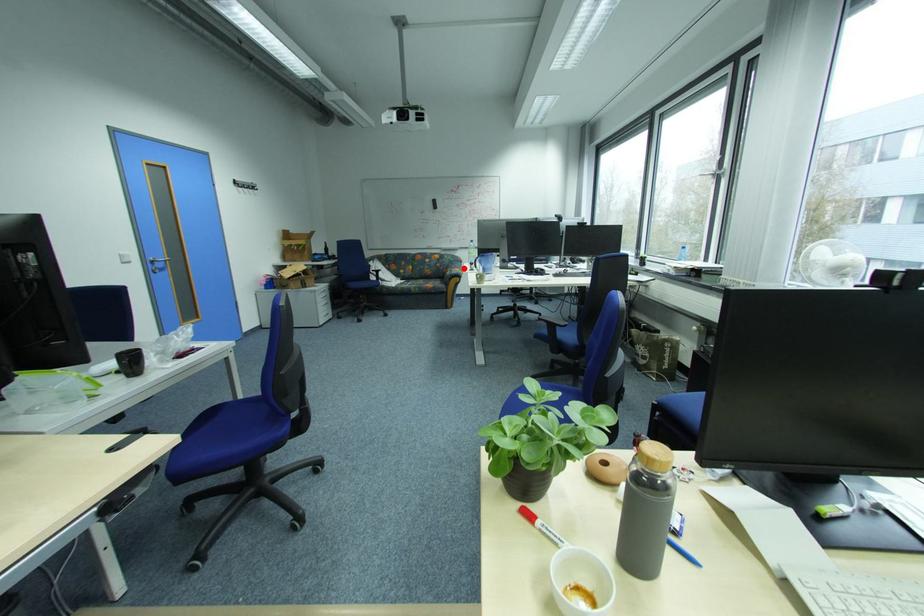
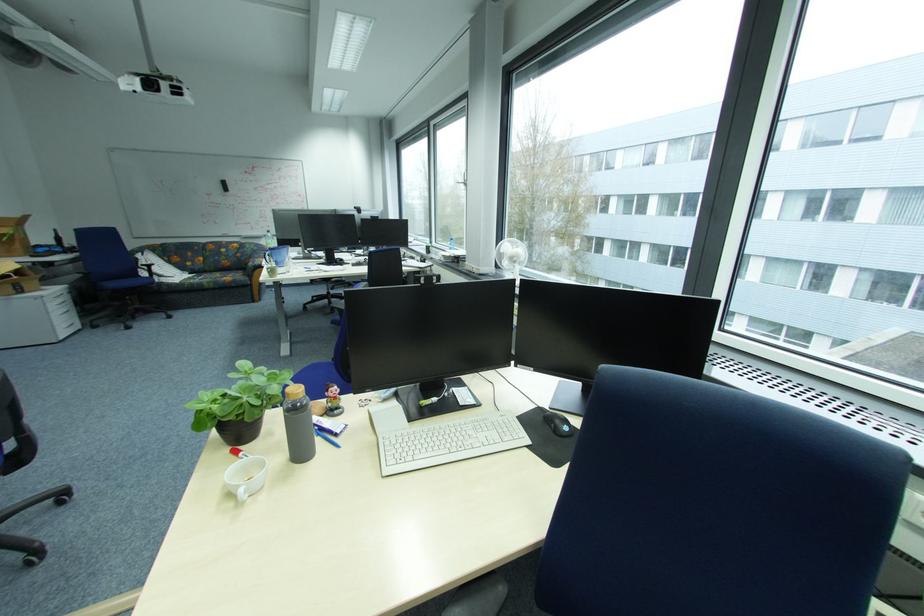
Question: I am providing you with two images of the same scene from different viewpoints. Image1 has a red point marked. In image2, the corresponding 3D location appears at what relative position? Reply with the corresponding letter.

Choices:
 (A) Closer
 (B) Farther

Answer: (B)